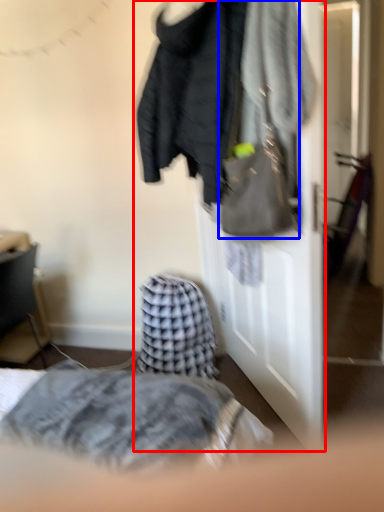
Question: Which of the following is the farthest to the observer, closet (highlighted by a red box) or handbag (highlighted by a blue box)?

Choices:
 (A) closet
 (B) handbag

Answer: (A)